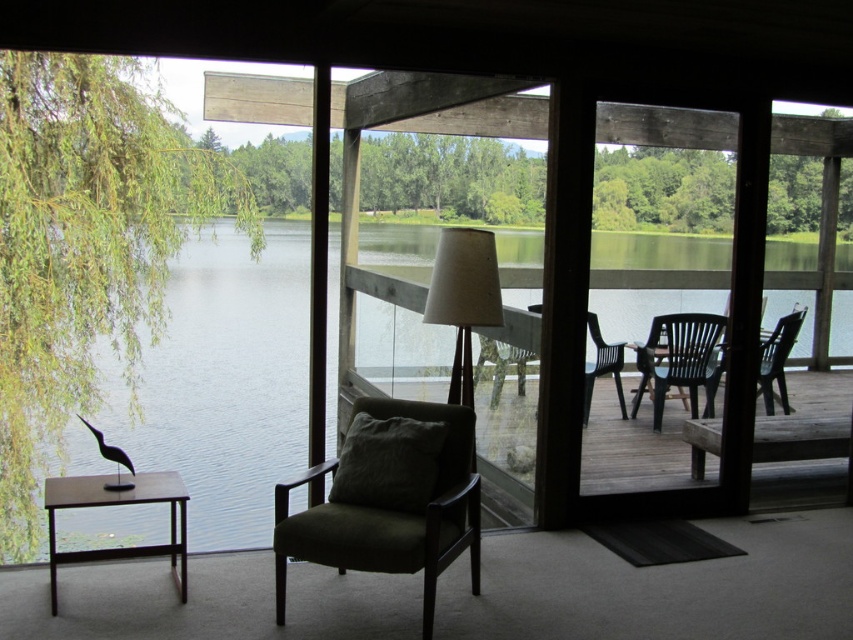
You are standing at the entrance of the room and want to sit in the dark green fabric armchair at center. Which direction should you move to reach it?

The dark green fabric armchair at center is located at point coordinates that are not explicitly directional, but based on typical room layouts, moving towards the center of the room from the entrance would lead you to the armchair.

You are standing inside the room and want to look out the window to see the green water at center. Based on the coordinates provided, which direction should you turn your head to look towards the center of the window?

The green water at center is located at coordinates approximately 60 percent from the left edge and 27 percent from the top edge of the window. To look towards this point, you should turn your head slightly to the right and down from the center of the window.

You are sitting in the dark green armchair inside the room and want to walk to the black plastic armchair at right outside. Which direction should you move relative to the matte brown table at left?

You should move away from the matte brown table at left to reach the black plastic armchair at right since the matte brown table at left is in front of the black plastic armchair at right.